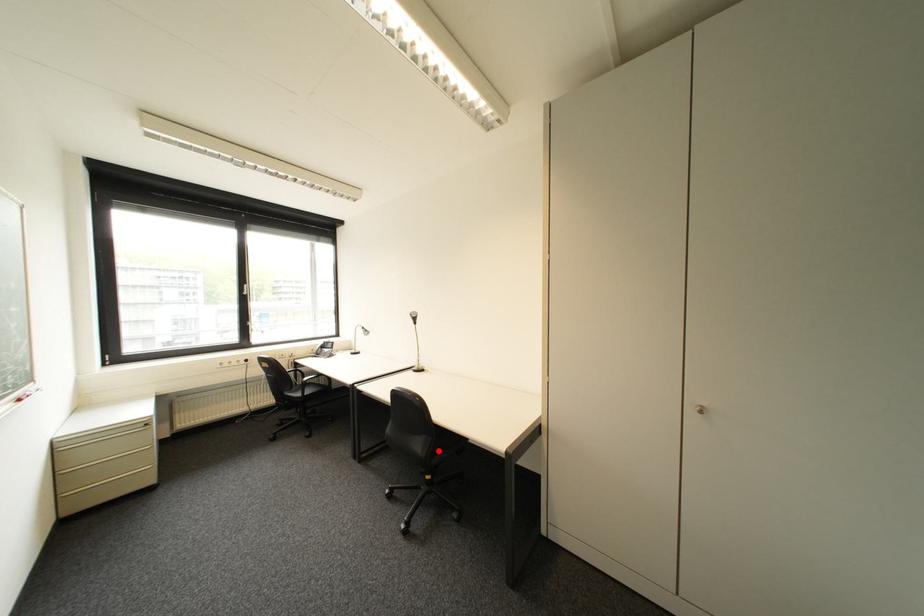
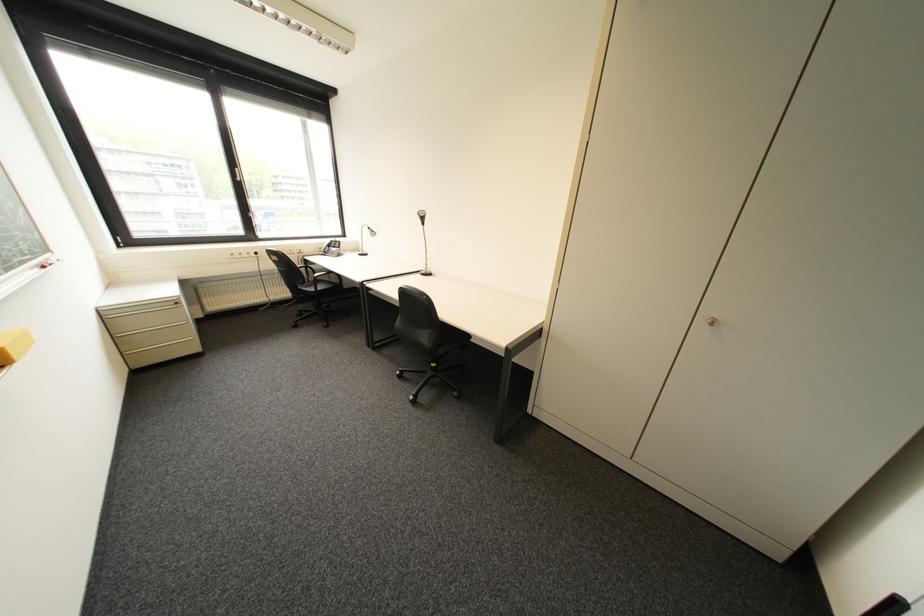
Locate, in the second image, the point that corresponds to the highlighted location in the first image.

(444, 342)